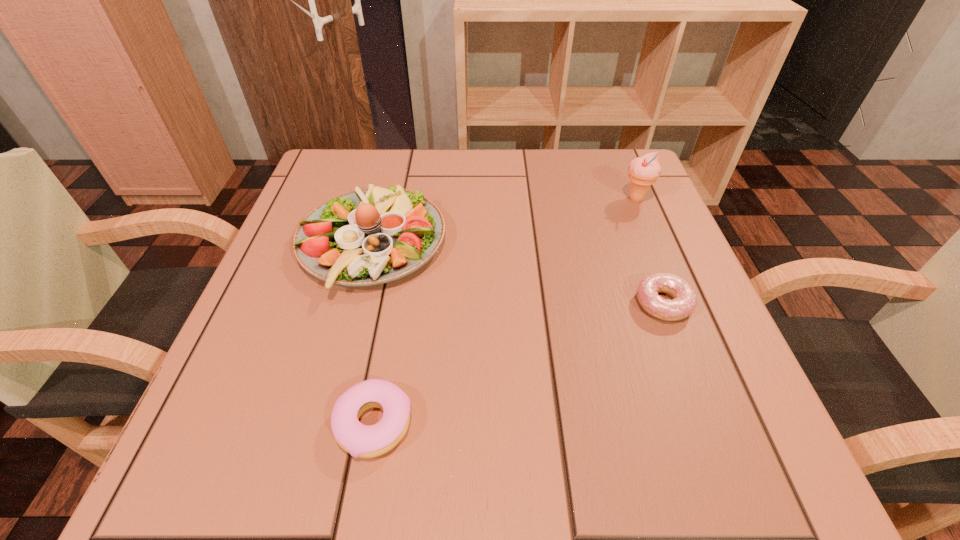
In the image, there is a desktop. Where is `vacant space at the right edge`? This screenshot has height=540, width=960. vacant space at the right edge is located at coordinates pos(660,347).

Find the location of a particular element. vacant space at the far left corner is located at coordinates (372, 164).

This screenshot has height=540, width=960. In the image, there is a desktop. In order to click on vacant space at the near right corner in this screenshot , I will do `click(692, 473)`.

I want to click on empty space between the nearer doughnut and the tallest object, so click(x=505, y=311).

At what (x,y) coordinates should I click in order to perform the action: click on empty space that is in between the nearest object and the tallest object. Please return your answer as a coordinate pair (x, y). The image size is (960, 540). Looking at the image, I should click on (505, 311).

Where is `vacant region between the salad plate and the left doughnut`? This screenshot has height=540, width=960. vacant region between the salad plate and the left doughnut is located at coordinates (372, 334).

Locate an element on the screen. free space that is in between the left doughnut and the icecream is located at coordinates (505, 311).

Image resolution: width=960 pixels, height=540 pixels. Find the location of `vacant area that lies between the nearest object and the tallest object`. vacant area that lies between the nearest object and the tallest object is located at coordinates (505, 311).

This screenshot has height=540, width=960. I want to click on vacant point located between the second tallest object and the right doughnut, so click(x=517, y=274).

The height and width of the screenshot is (540, 960). Identify the location of vacant point located between the right doughnut and the nearer doughnut. (518, 364).